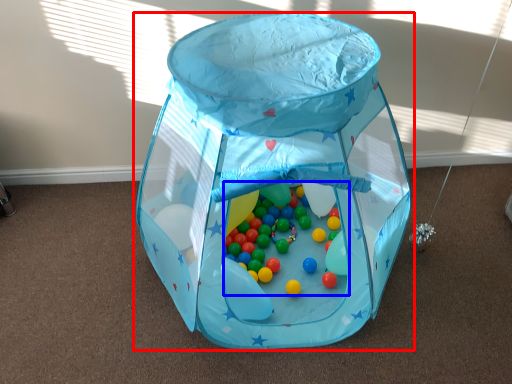
Question: Which object appears closest to the camera in this image, toy (highlighted by a red box) or toy (highlighted by a blue box)?

Choices:
 (A) toy
 (B) toy

Answer: (A)